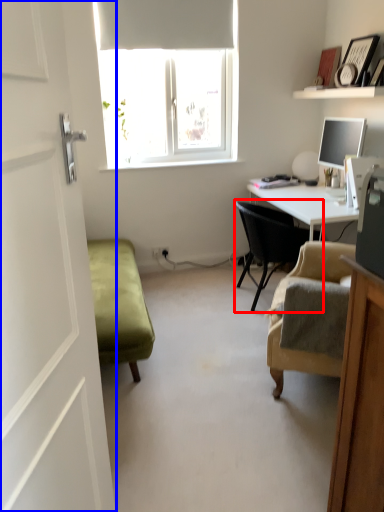
Question: Which object appears farthest to the camera in this image, chair (highlighted by a red box) or screen door (highlighted by a blue box)?

Choices:
 (A) chair
 (B) screen door

Answer: (A)